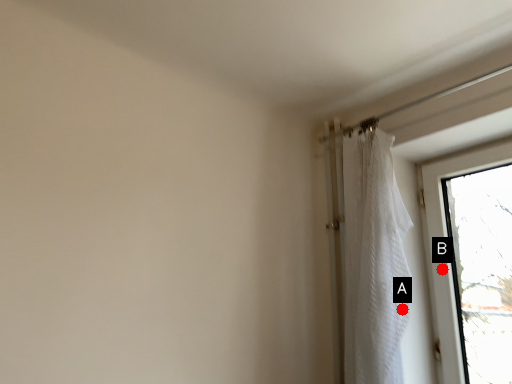
Question: Two points are circled on the image, labeled by A and B beside each circle. Which point appears farthest from the camera in this image?

Choices:
 (A) A is further
 (B) B is further

Answer: (B)